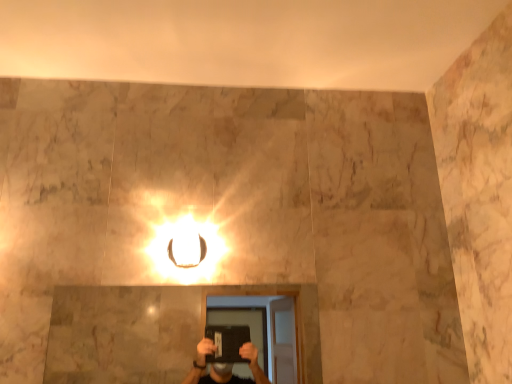
This screenshot has width=512, height=384. Describe the element at coordinates (187, 246) in the screenshot. I see `matte gold ring at center` at that location.

Where is `matte gold ring at center`? Image resolution: width=512 pixels, height=384 pixels. matte gold ring at center is located at coordinates tap(187, 246).

I want to click on matte gold ring at center, so click(187, 246).